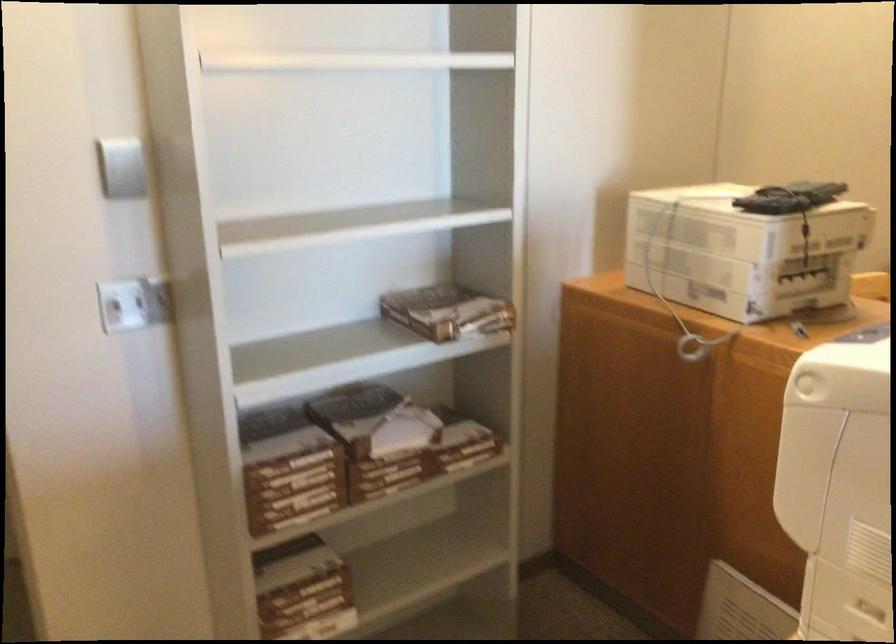
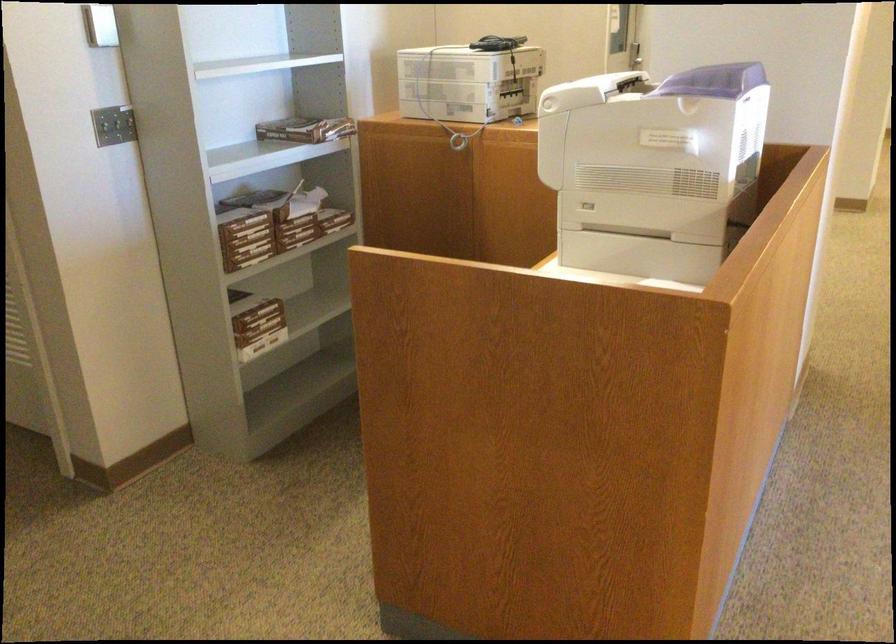
Where in the second image is the point corresponding to point (435, 328) from the first image?

(306, 129)